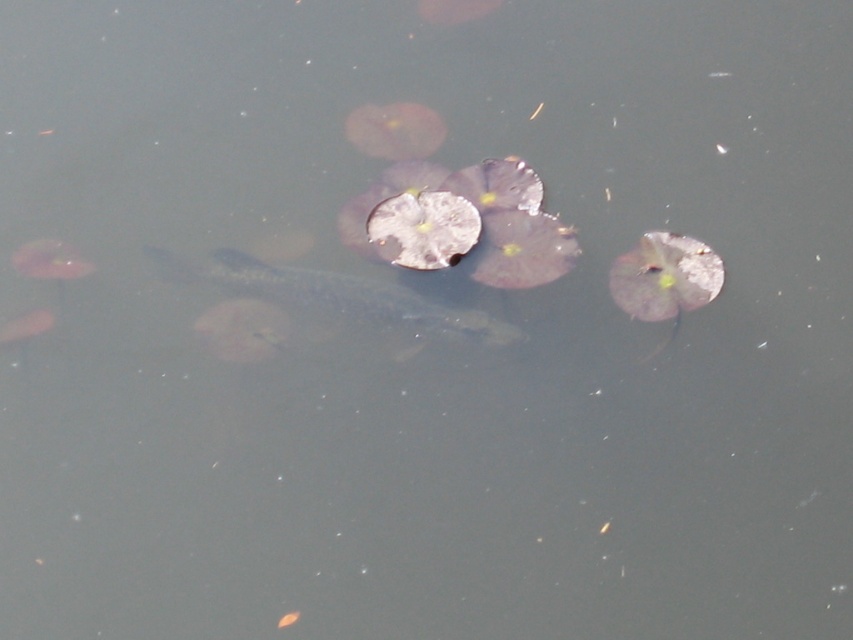
Question: Which of these objects is positioned farthest from the translucent gray fish at lower left?

Choices:
 (A) silvery metallic fish at center
 (B) translucent gray fish at left

Answer: (A)

Question: Is silvery metallic fish at center positioned before translucent gray fish at left?

Choices:
 (A) no
 (B) yes

Answer: (A)

Question: Does silvery metallic fish at center have a lesser width compared to translucent gray fish at lower left?

Choices:
 (A) yes
 (B) no

Answer: (B)

Question: In this image, where is silvery metallic fish at center located relative to translucent gray fish at lower left?

Choices:
 (A) left
 (B) right

Answer: (B)

Question: Among these points, which one is farthest from the camera?

Choices:
 (A) (76, 272)
 (B) (380, 298)
 (C) (3, 328)

Answer: (B)

Question: Which point is closer to the camera taking this photo?

Choices:
 (A) (294, 301)
 (B) (74, 260)
 (C) (33, 321)

Answer: (C)